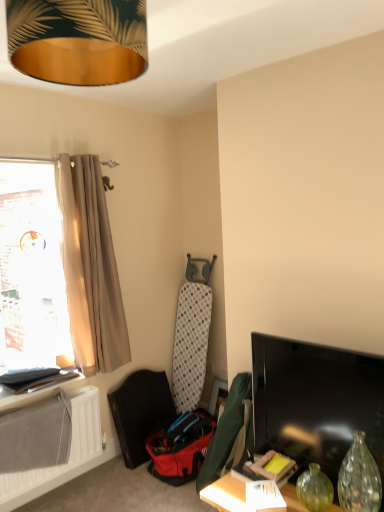
Question: In the image, is matte black shelf at lower left on the left side or the right side of black glossy tv at right?

Choices:
 (A) right
 (B) left

Answer: (B)

Question: Looking at their shapes, would you say matte black shelf at lower left is wider or thinner than black glossy tv at right?

Choices:
 (A) wide
 (B) thin

Answer: (A)

Question: Estimate the real-world distances between objects in this image. Which object is farther from the transparent glass vase at lower right?

Choices:
 (A) black glossy tv at right
 (B) black textured swivel chair at lower left
 (C) gold metallic lampshade at upper center
 (D) beige fabric curtain at left
 (E) white matte radiator at lower left

Answer: (D)

Question: Which object is positioned closest to the black textured swivel chair at lower left?

Choices:
 (A) gold metallic lampshade at upper center
 (B) matte green picture frame at lower right
 (C) beige fabric curtain at left
 (D) black glossy tv at right
 (E) translucent beige curtain at left

Answer: (B)